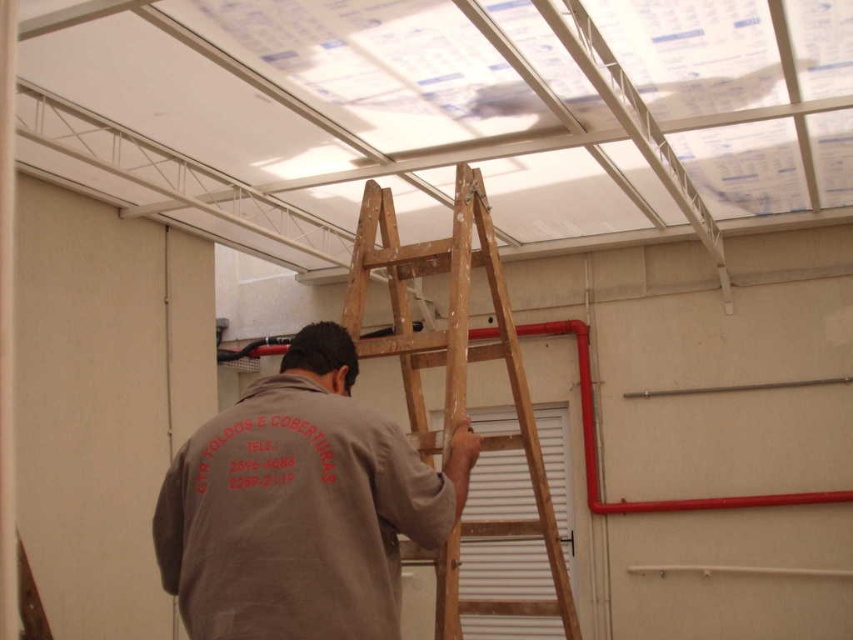
Question: Which object is farther from the camera taking this photo?

Choices:
 (A) brown cotton shirt at center
 (B) wooden at upper center

Answer: (B)

Question: Among these points, which one is nearest to the camera?

Choices:
 (A) (523, 406)
 (B) (399, 524)

Answer: (B)

Question: Among these objects, which one is nearest to the camera?

Choices:
 (A) wooden at upper center
 (B) brown cotton shirt at center

Answer: (B)

Question: Does brown cotton shirt at center appear on the right side of wooden at upper center?

Choices:
 (A) yes
 (B) no

Answer: (B)

Question: From the image, what is the correct spatial relationship of brown cotton shirt at center in relation to wooden at upper center?

Choices:
 (A) left
 (B) right

Answer: (A)

Question: Does brown cotton shirt at center appear under wooden at upper center?

Choices:
 (A) yes
 (B) no

Answer: (A)